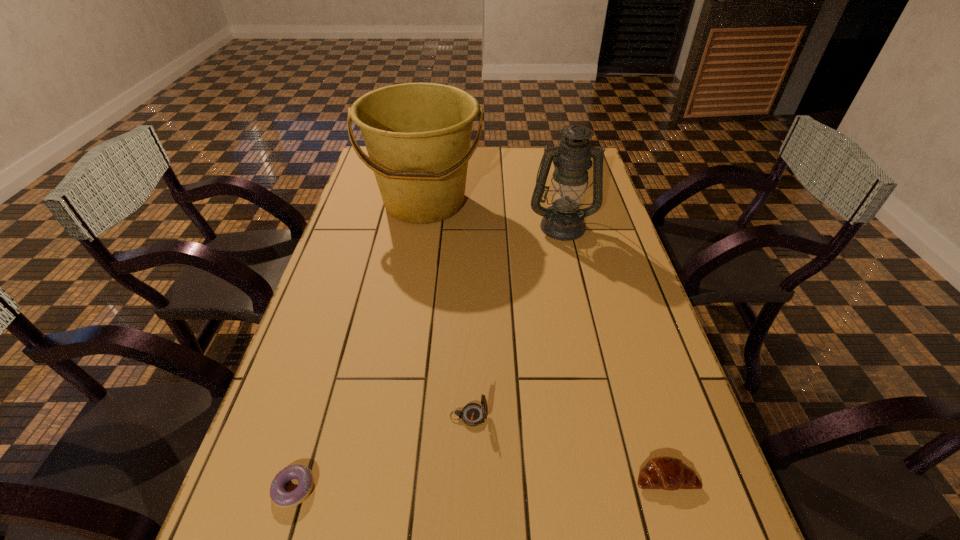
Point out which object is positioned as the nearest to the doughnut. Please provide its 2D coordinates. Your answer should be formatted as a tuple, i.e. [(x, y)], where the tuple contains the x and y coordinates of a point satisfying the conditions above.

[(473, 414)]

Identify the location of object that is the third closest to the oil lamp. (667, 473).

At what (x,y) coordinates should I click in order to perform the action: click on free spot that satisfies the following two spatial constraints: 1. on the face of the compass; 2. on the left side of the second shortest object. Please return your answer as a coordinate pair (x, y). The width and height of the screenshot is (960, 540). Looking at the image, I should click on (468, 477).

The height and width of the screenshot is (540, 960). I want to click on blank area in the image that satisfies the following two spatial constraints: 1. on the side of the bucket with the handle; 2. on the right side of the crescent roll, so point(380,477).

The image size is (960, 540). I want to click on free location that satisfies the following two spatial constraints: 1. on the front side of the oil lamp; 2. on the left side of the crescent roll, so click(620, 477).